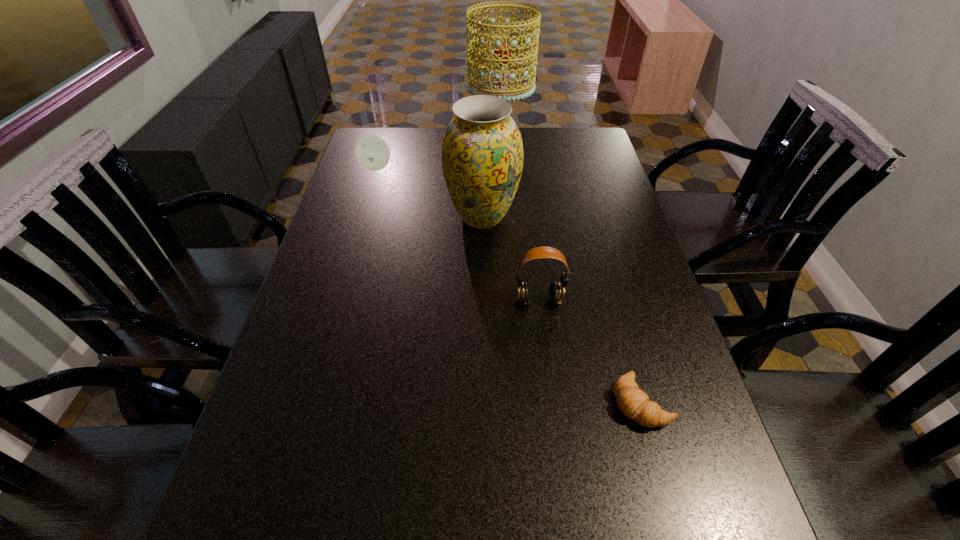
This screenshot has height=540, width=960. In order to click on blank area located 0.380m on the front of the fourth shortest object in this screenshot , I will do `click(483, 353)`.

The image size is (960, 540). What are the coordinates of `free point located on the ear cups of the headset` in the screenshot? It's located at (542, 329).

Find the location of a particular element. The width and height of the screenshot is (960, 540). vacant area situated on the right of the leftmost object is located at coordinates [413, 167].

Locate an element on the screen. The image size is (960, 540). vacant space situated 0.360m on the back of the rightmost object is located at coordinates (602, 260).

What are the coordinates of `lampshade that is at the far edge` in the screenshot? It's located at (502, 58).

This screenshot has width=960, height=540. Find the location of `apple that is at the far edge`. apple that is at the far edge is located at coordinates (372, 152).

The height and width of the screenshot is (540, 960). In order to click on object situated at the left edge in this screenshot , I will do `click(372, 152)`.

Image resolution: width=960 pixels, height=540 pixels. Identify the location of object located at the right edge. (634, 403).

Locate an element on the screen. The height and width of the screenshot is (540, 960). object situated at the far left corner is located at coordinates (372, 152).

In the image, there is a desktop. Find the location of `vacant space at the far edge`. vacant space at the far edge is located at coordinates (435, 137).